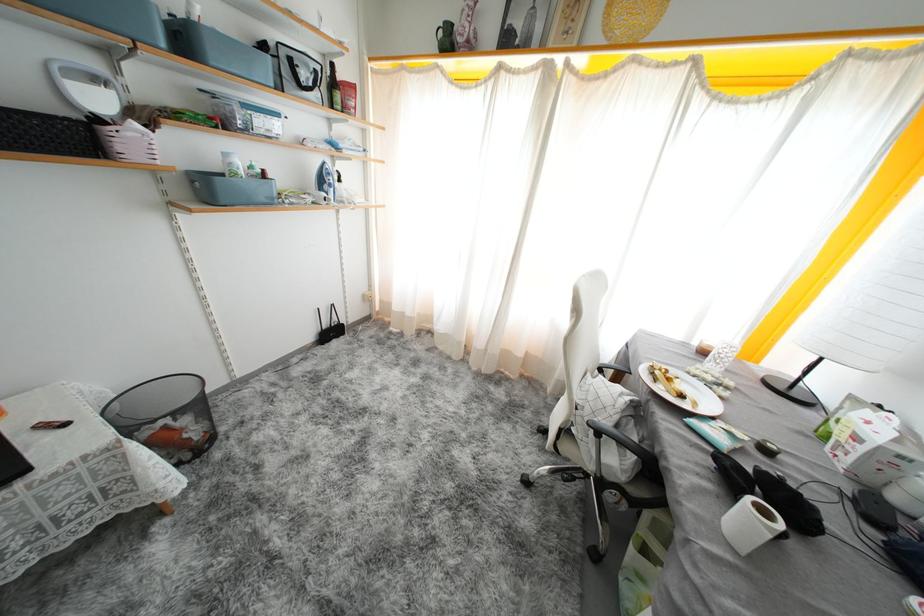
Find where to lift the toilet paper roll. Please return your answer as a coordinate pair (x, y).

(749, 524)